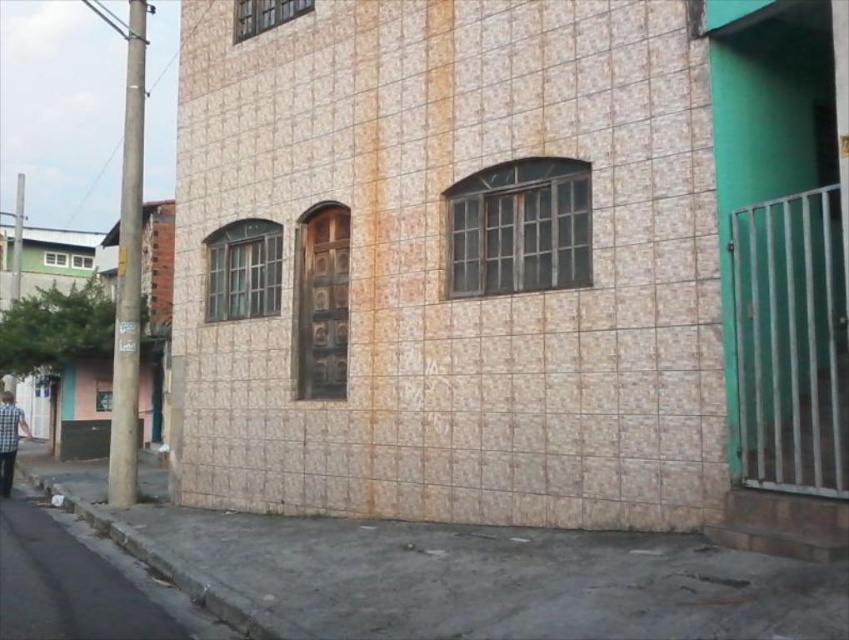
You are standing in front of the building and want to locate the matte glass window at center left. According to the coordinates provided, where exactly is it positioned?

The matte glass window at center left is located at point 0.423 on the x axis and 0.287 on the y axis.

You are standing in front of the building and want to enter through the wooden door. Which window is positioned to the right side of the other between the matte glass window at center left and the matte glass window at upper left?

The matte glass window at center left is positioned to the right of the matte glass window at upper left.

You are standing in front of the building and want to take a photo of the clear glass window at upper center. If your camera has a maximum focus range of 6 meters, will it be able to capture the window clearly?

The clear glass window at upper center is 5.95 meters away from the camera, which is within the maximum focus range of 6 meters. Therefore, the camera should be able to capture the window clearly.